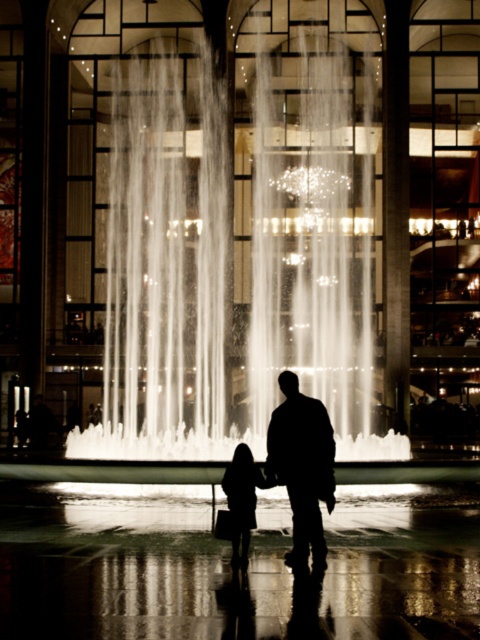
Does silhouette fabric at center have a greater height compared to silhouette dress at center?

Correct, silhouette fabric at center is much taller as silhouette dress at center.

Who is lower down, silhouette fabric at center or silhouette dress at center?

silhouette dress at center

Where is `silhouette fabric at center`? This screenshot has width=480, height=640. silhouette fabric at center is located at coordinates (301, 467).